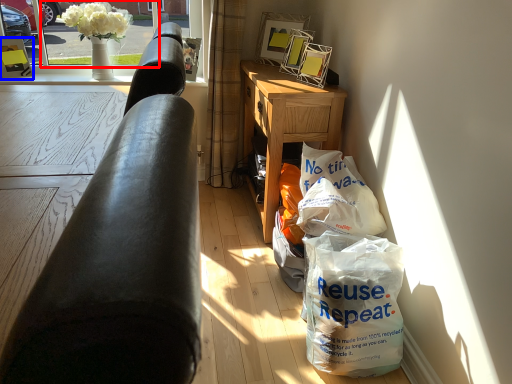
Question: Which of the following is the closest to the observer, window screen (highlighted by a red box) or picture frame (highlighted by a blue box)?

Choices:
 (A) window screen
 (B) picture frame

Answer: (A)